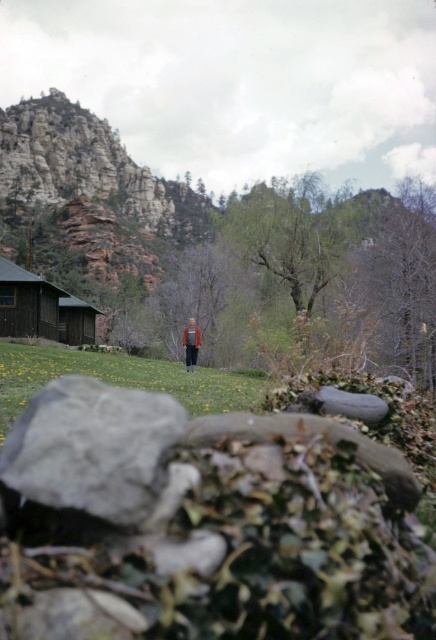
Question: Which object is farther from the camera taking this photo?

Choices:
 (A) green grass at center
 (B) dark brown wooden cabin at left

Answer: (B)

Question: Which object is closer to the camera taking this photo?

Choices:
 (A) dark brown leather jacket at center
 (B) green grass at center

Answer: (B)

Question: Does gray rough rock at lower left appear over dark brown wooden cabin at left?

Choices:
 (A) no
 (B) yes

Answer: (A)

Question: Is gray rough rock at lower left above dark brown wooden cabin at left?

Choices:
 (A) yes
 (B) no

Answer: (B)

Question: Does dark brown wooden cabin at left have a smaller size compared to dark brown leather jacket at center?

Choices:
 (A) yes
 (B) no

Answer: (B)

Question: Which is farther from the dark brown wooden cabin at left?

Choices:
 (A) gray rough rock at lower left
 (B) green grass at center
 (C) dark brown leather jacket at center

Answer: (A)